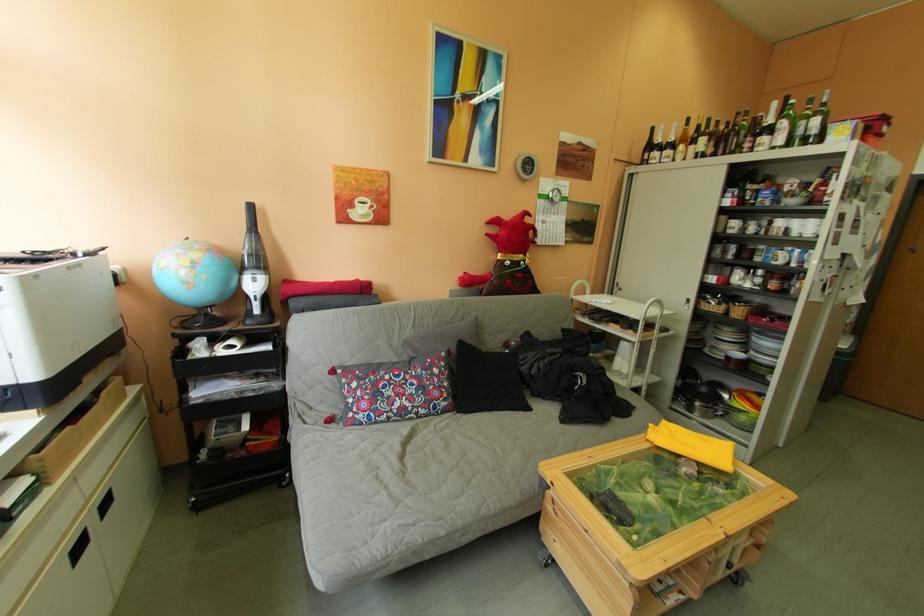
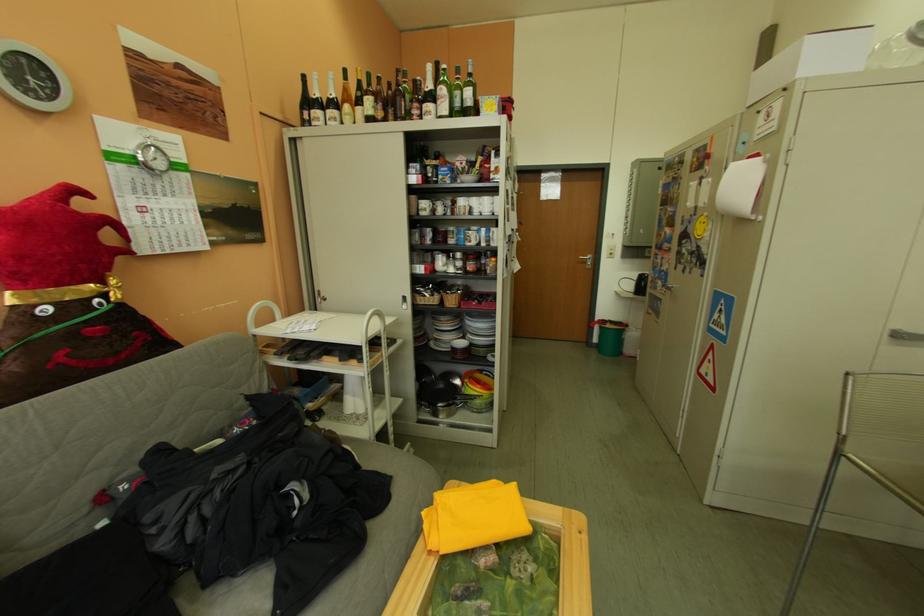
Where in the second image is the point corresponding to [739,416] from the first image?

(478, 405)